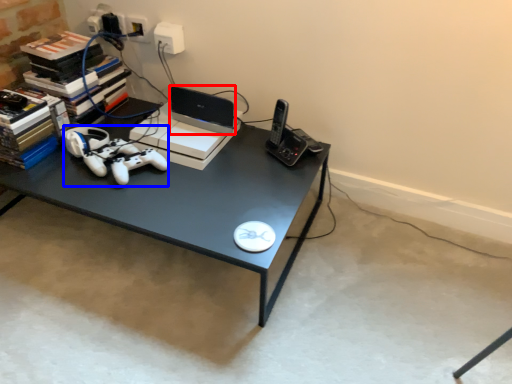
Question: Among these objects, which one is farthest to the camera, laptop (highlighted by a red box) or game controller (highlighted by a blue box)?

Choices:
 (A) laptop
 (B) game controller

Answer: (A)